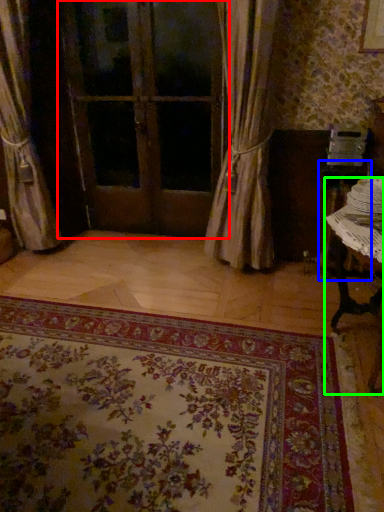
Question: Which object is positioned farthest from door (highlighted by a red box)? Select from table (highlighted by a blue box) and table (highlighted by a green box).

Choices:
 (A) table
 (B) table

Answer: (B)